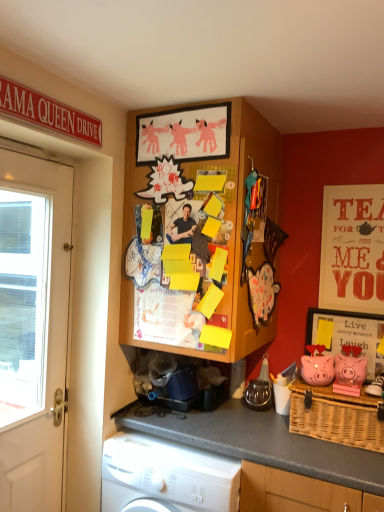
Question: Is wooden board at upper center at the right side of pink matte piggy bank at right, the 2th pig from the left?

Choices:
 (A) yes
 (B) no

Answer: (B)

Question: Considering the relative positions of wooden board at upper center and pink matte piggy bank at right, the 2th pig from the left, in the image provided, is wooden board at upper center to the left of pink matte piggy bank at right, the 2th pig from the left, from the viewer's perspective?

Choices:
 (A) no
 (B) yes

Answer: (B)

Question: Is wooden board at upper center looking in the opposite direction of pink matte piggy bank at right, which appears as the first pig when viewed from the right?

Choices:
 (A) yes
 (B) no

Answer: (B)

Question: Is wooden board at upper center taller than pink matte piggy bank at right, which appears as the first pig when viewed from the right?

Choices:
 (A) no
 (B) yes

Answer: (B)

Question: Is wooden board at upper center shorter than pink matte piggy bank at right, the 2th pig from the left?

Choices:
 (A) no
 (B) yes

Answer: (A)

Question: In terms of height, does white plastic washing machine at lower left look taller or shorter compared to matte red poster at upper right?

Choices:
 (A) tall
 (B) short

Answer: (B)

Question: In terms of width, does white plastic washing machine at lower left look wider or thinner when compared to matte red poster at upper right?

Choices:
 (A) thin
 (B) wide

Answer: (B)

Question: Looking at the image, does white plastic washing machine at lower left seem bigger or smaller compared to matte red poster at upper right?

Choices:
 (A) big
 (B) small

Answer: (A)

Question: Is point (127, 439) positioned closer to the camera than point (350, 218)?

Choices:
 (A) farther
 (B) closer

Answer: (B)

Question: Is point (183, 115) closer or farther from the camera than point (359, 354)?

Choices:
 (A) farther
 (B) closer

Answer: (B)

Question: Do you think matte pink paper at upper center, positioned as the first picture frame in left-to-right order, is within pink matte piggy bank at right, which appears as the first pig when viewed from the right, or outside of it?

Choices:
 (A) inside
 (B) outside

Answer: (B)

Question: From their relative heights in the image, would you say matte pink paper at upper center, positioned as the first picture frame in left-to-right order, is taller or shorter than pink matte piggy bank at right, which appears as the first pig when viewed from the right?

Choices:
 (A) tall
 (B) short

Answer: (A)

Question: Considering the relative positions of matte pink paper at upper center, acting as the first picture frame starting from the front, and pink matte piggy bank at right, which appears as the first pig when viewed from the right, in the image provided, is matte pink paper at upper center, acting as the first picture frame starting from the front, to the left or to the right of pink matte piggy bank at right, which appears as the first pig when viewed from the right,?

Choices:
 (A) right
 (B) left

Answer: (B)

Question: Based on their positions, is woven wicker picnic basket at lower right located to the left or right of pink matte piggy bank at right, which appears as the first pig when viewed from the right?

Choices:
 (A) right
 (B) left

Answer: (B)

Question: Considering the positions of point (321, 399) and point (359, 380), is point (321, 399) closer or farther from the camera than point (359, 380)?

Choices:
 (A) farther
 (B) closer

Answer: (B)